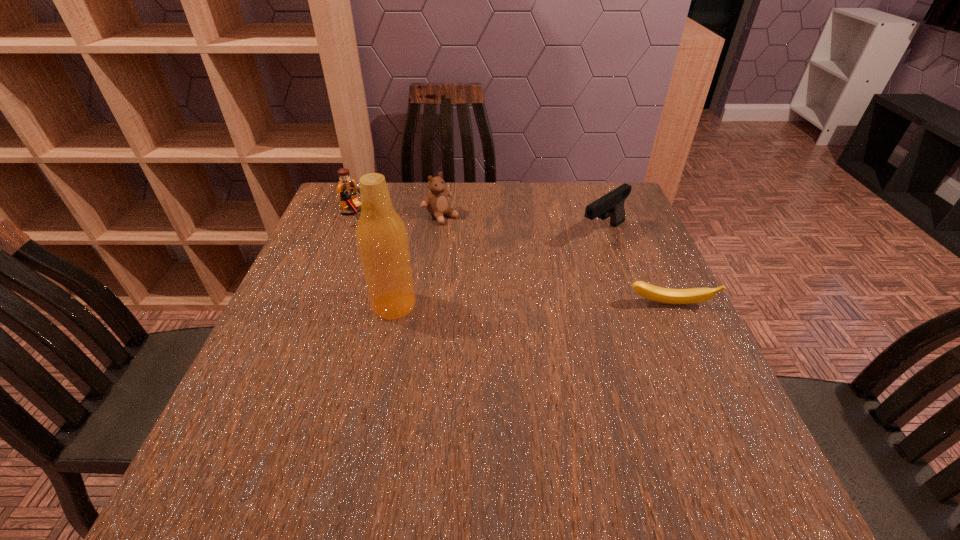
Find the location of `free space that satisfies the following two spatial constraints: 1. on the back side of the pistol; 2. on the left side of the tallest object`. free space that satisfies the following two spatial constraints: 1. on the back side of the pistol; 2. on the left side of the tallest object is located at coordinates (409, 233).